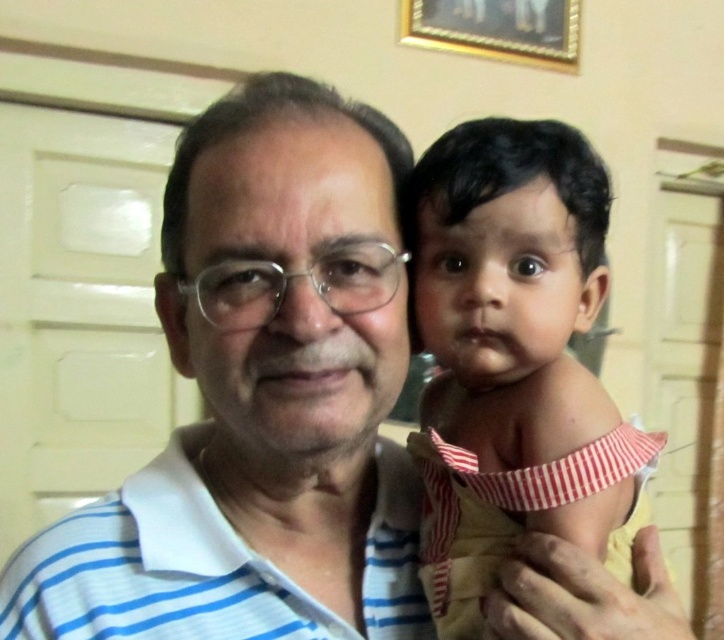
Question: Can you confirm if soft beige cloth at right is wider than gold-framed picture at upper center?

Choices:
 (A) yes
 (B) no

Answer: (B)

Question: Which object is positioned closest to the soft beige cloth at right?

Choices:
 (A) gold-framed picture at upper center
 (B) white striped polo shirt at center

Answer: (B)

Question: Which point is closer to the camera taking this photo?

Choices:
 (A) (552, 28)
 (B) (560, 259)

Answer: (B)

Question: Estimate the real-world distances between objects in this image. Which object is farther from the white striped polo shirt at center?

Choices:
 (A) soft beige cloth at right
 (B) gold-framed picture at upper center

Answer: (B)

Question: Does soft beige cloth at right come behind gold-framed picture at upper center?

Choices:
 (A) yes
 (B) no

Answer: (B)

Question: Can you confirm if white striped polo shirt at center is positioned below gold-framed picture at upper center?

Choices:
 (A) yes
 (B) no

Answer: (A)